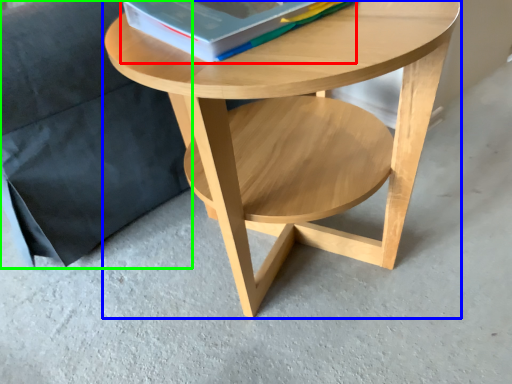
Question: Estimate the real-world distances between objects in this image. Which object is closer to paperback book (highlighted by a red box), coffee table (highlighted by a blue box) or armchair (highlighted by a green box)?

Choices:
 (A) coffee table
 (B) armchair

Answer: (A)